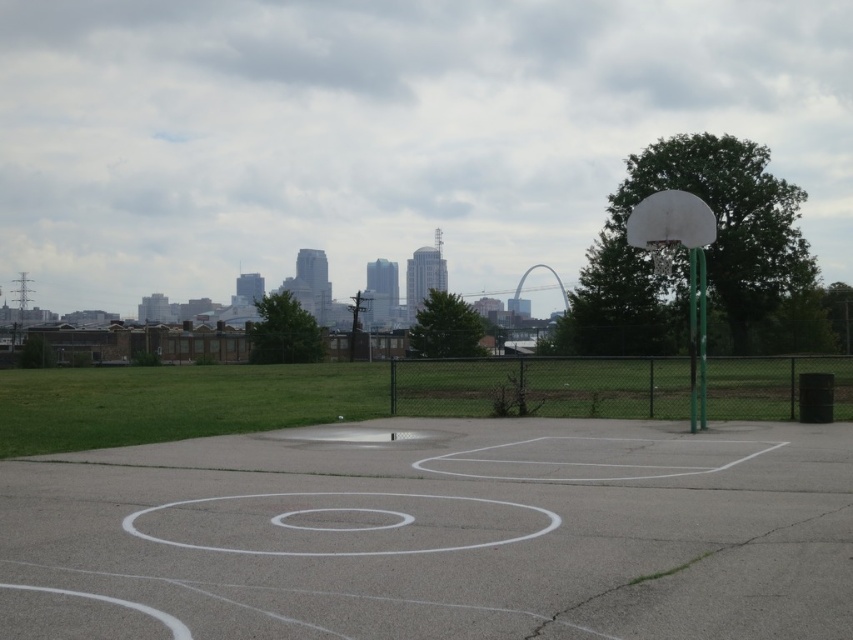
Question: Which point is farther from the camera taking this photo?

Choices:
 (A) (129, 637)
 (B) (694, 243)

Answer: (B)

Question: Is white concrete basketball court at center closer to camera compared to white matte basketball hoop at right?

Choices:
 (A) yes
 (B) no

Answer: (A)

Question: Can you confirm if white concrete basketball court at center is thinner than white matte basketball hoop at right?

Choices:
 (A) no
 (B) yes

Answer: (B)

Question: Which point is closer to the camera?

Choices:
 (A) (693, 256)
 (B) (589, 435)

Answer: (B)

Question: Observing the image, what is the correct spatial positioning of white concrete basketball court at center in reference to white matte basketball hoop at right?

Choices:
 (A) above
 (B) below

Answer: (B)